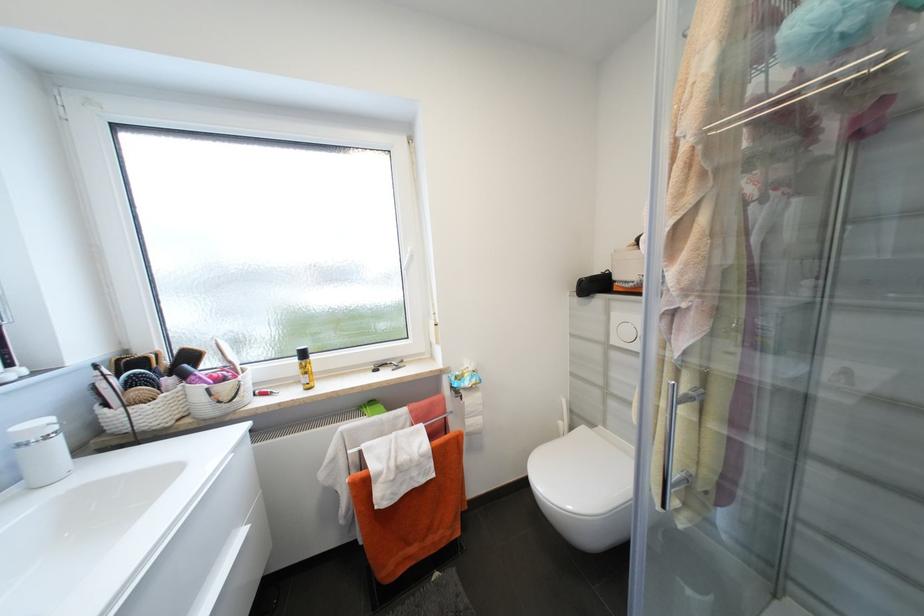
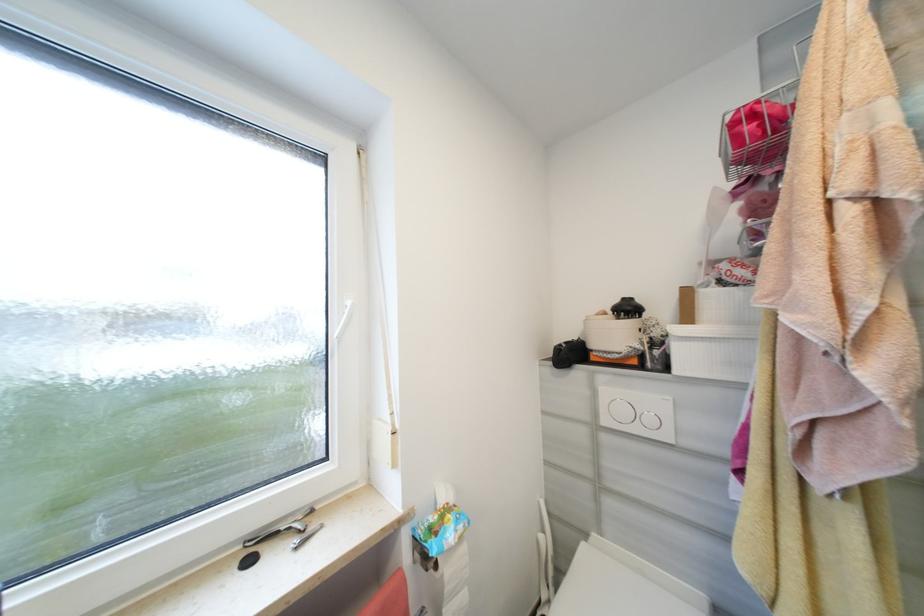
Question: How did the camera likely rotate?

Choices:
 (A) Left
 (B) Right
 (C) Up
 (D) Down

Answer: (B)